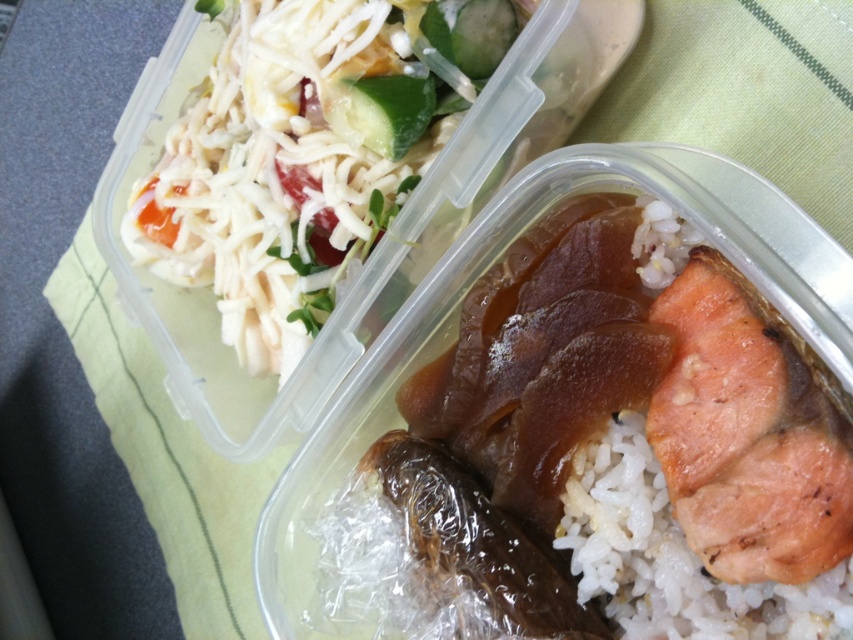
You are a food delivery person who needs to pick up the container with the salad. The containers are placed side by side on a light green surface with stripes. You see two containers. The left container has shredded white cheese, cucumbers, tomatoes, and greens. The right container has rice, grilled salmon, and sauce. A green crisp cucumber is at point (381, 112). Which container should you pick?

The green crisp cucumber at upper center is located at point (381, 112), which is in the left container. Therefore, you should pick the left container.

From the picture: You are a food delivery person who needs to place the salad container and the rice container into a delivery bag. The bag has a divider that separates the upper and lower sections. Which container should you place in the upper section to match the position of the white shredded cheese at upper left relative to the white matte rice at center in the original image?

You should place the salad container with the white shredded cheese at upper left in the upper section of the bag because it is above the white matte rice at center in the original image.